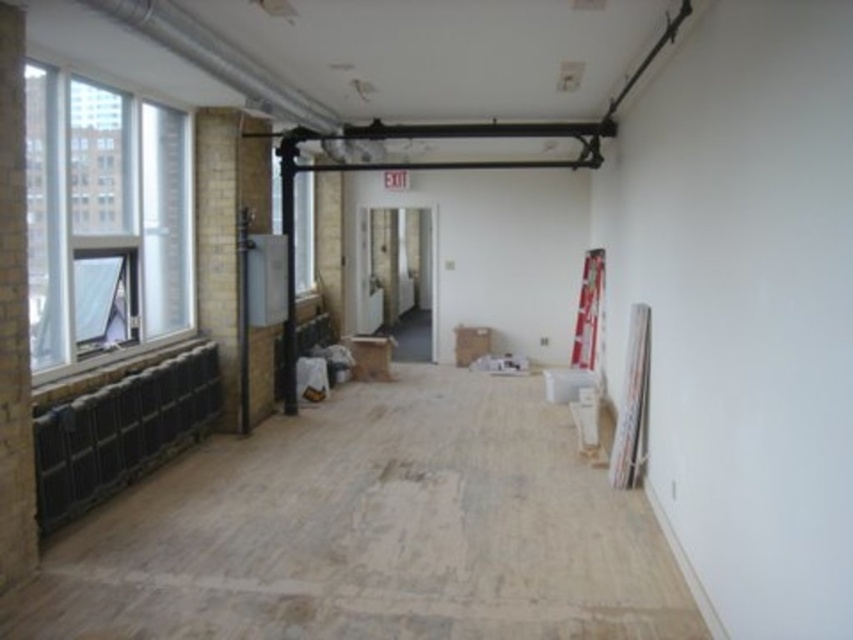
Question: In this image, where is clear glass window at left located relative to clear glass window at center?

Choices:
 (A) right
 (B) left

Answer: (B)

Question: Which point is closer to the camera?

Choices:
 (A) clear glass window at center
 (B) brick wall at left
 (C) clear glass window at left

Answer: (B)

Question: Considering the real-world distances, which object is closest to the brick wall at left?

Choices:
 (A) clear glass window at left
 (B) clear glass window at center

Answer: (A)

Question: From the image, what is the correct spatial relationship of clear glass window at left in relation to brick wall at left?

Choices:
 (A) above
 (B) below

Answer: (A)

Question: In this image, where is clear glass window at left located relative to brick wall at left?

Choices:
 (A) below
 (B) above

Answer: (B)

Question: Among these points, which one is nearest to the camera?

Choices:
 (A) (146, 296)
 (B) (25, 284)

Answer: (B)